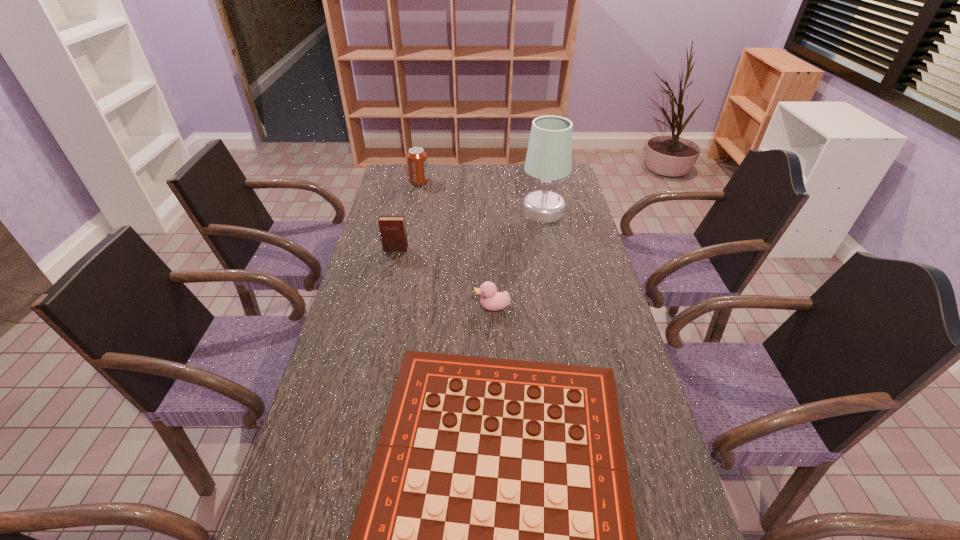
This screenshot has height=540, width=960. What are the coordinates of `vacant space situated 0.180m on the front-facing side of the duckling` in the screenshot? It's located at (414, 307).

This screenshot has width=960, height=540. Find the location of `vacant space located 0.060m on the front-facing side of the duckling`. vacant space located 0.060m on the front-facing side of the duckling is located at coordinates (454, 307).

Where is `object present at the far edge`? object present at the far edge is located at coordinates (417, 163).

This screenshot has width=960, height=540. What are the coordinates of `can located in the left edge section of the desktop` in the screenshot? It's located at (417, 163).

Image resolution: width=960 pixels, height=540 pixels. What are the coordinates of `diary situated at the left edge` in the screenshot? It's located at (393, 234).

Where is `object present at the right edge`? The height and width of the screenshot is (540, 960). object present at the right edge is located at coordinates (549, 154).

Where is `object at the far left corner`? The height and width of the screenshot is (540, 960). object at the far left corner is located at coordinates (417, 163).

In the image, there is a desktop. Where is `vacant space at the far edge`? The image size is (960, 540). vacant space at the far edge is located at coordinates (490, 184).

This screenshot has width=960, height=540. In the image, there is a desktop. What are the coordinates of `blank space at the left edge` in the screenshot? It's located at (322, 453).

The width and height of the screenshot is (960, 540). What are the coordinates of `vacant space at the right edge of the desktop` in the screenshot? It's located at (558, 264).